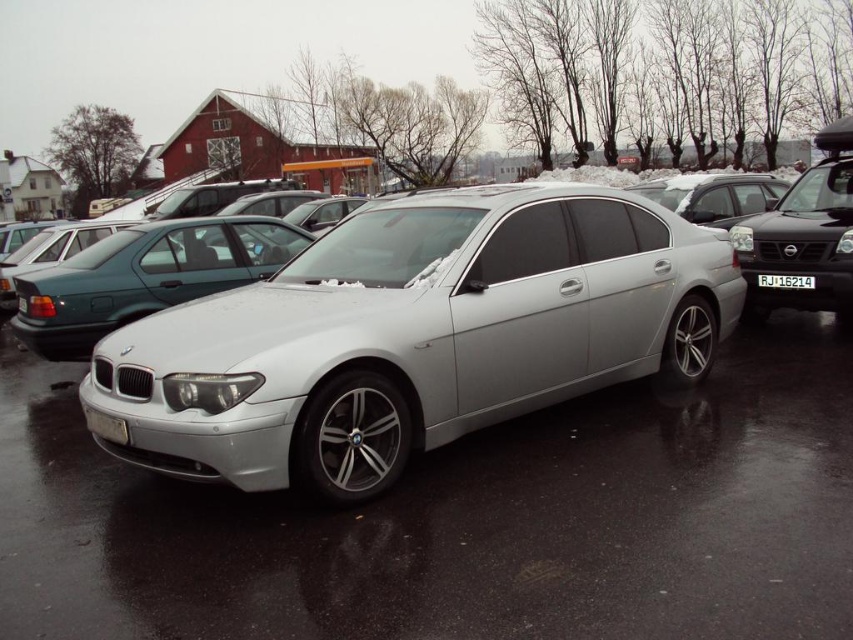
Question: Observing the image, what is the correct spatial positioning of satin silver sedan at center in reference to white plastic license plate at center?

Choices:
 (A) left
 (B) right

Answer: (A)

Question: Is satin silver sedan at center bigger than white plastic license plate at center?

Choices:
 (A) no
 (B) yes

Answer: (B)

Question: Which point appears farthest from the camera in this image?

Choices:
 (A) (764, 284)
 (B) (303, 333)

Answer: (A)

Question: Among these points, which one is farthest from the camera?

Choices:
 (A) (538, 186)
 (B) (788, 276)

Answer: (B)

Question: Which point is closer to the camera?

Choices:
 (A) satin silver sedan at center
 (B) white plastic license plate at center

Answer: (A)

Question: Is satin silver sedan at center below white plastic license plate at center?

Choices:
 (A) yes
 (B) no

Answer: (A)